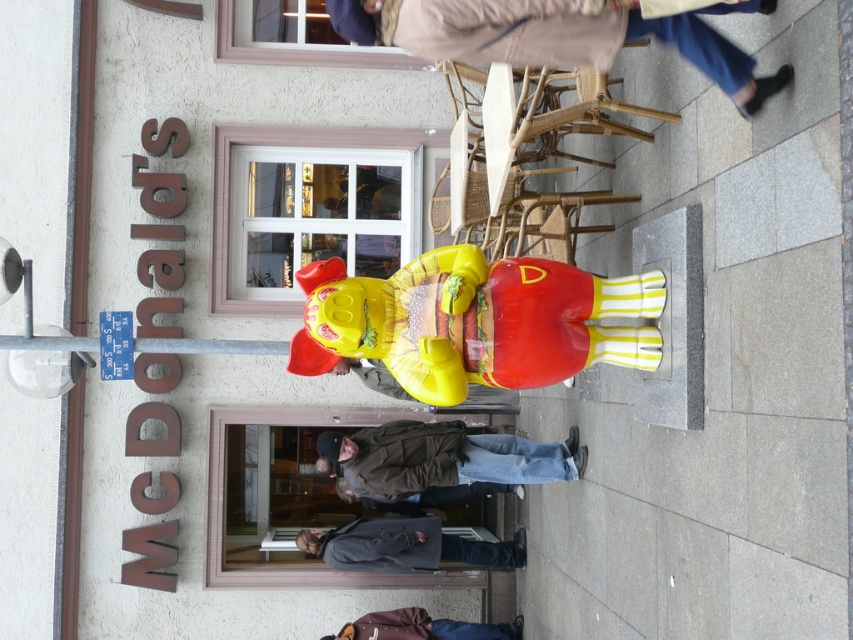
Which is behind, point (389, 284) or point (561, 44)?

Positioned behind is point (389, 284).

Is point (374, 305) positioned before point (642, 17)?

No, (374, 305) is further to viewer.

You are a GUI agent. You are given a task and a screenshot of the screen. Output one action in this format:
    pyautogui.click(x=<x>, y=<y>)
    Task: Click on the glossy plastic bear at center
    
    Given the screenshot: What is the action you would take?
    pyautogui.click(x=473, y=321)

Consider the image. Can you confirm if transparent glass door at center is wider than transparent glass window at upper center?

In fact, transparent glass door at center might be narrower than transparent glass window at upper center.

Based on the photo, which is more to the right, transparent glass door at center or transparent glass window at upper center?

Positioned to the right is transparent glass window at upper center.

I want to click on transparent glass door at center, so click(283, 497).

Locate an element on the screen. transparent glass door at center is located at coordinates (283, 497).

Can you confirm if brown leather jacket at lower center is taller than dark gray fabric jacket at lower center?

Indeed, brown leather jacket at lower center has a greater height compared to dark gray fabric jacket at lower center.

Which is in front, point (582, 464) or point (370, 564)?

Point (582, 464) is in front.

This screenshot has height=640, width=853. I want to click on brown leather jacket at lower center, so click(x=445, y=456).